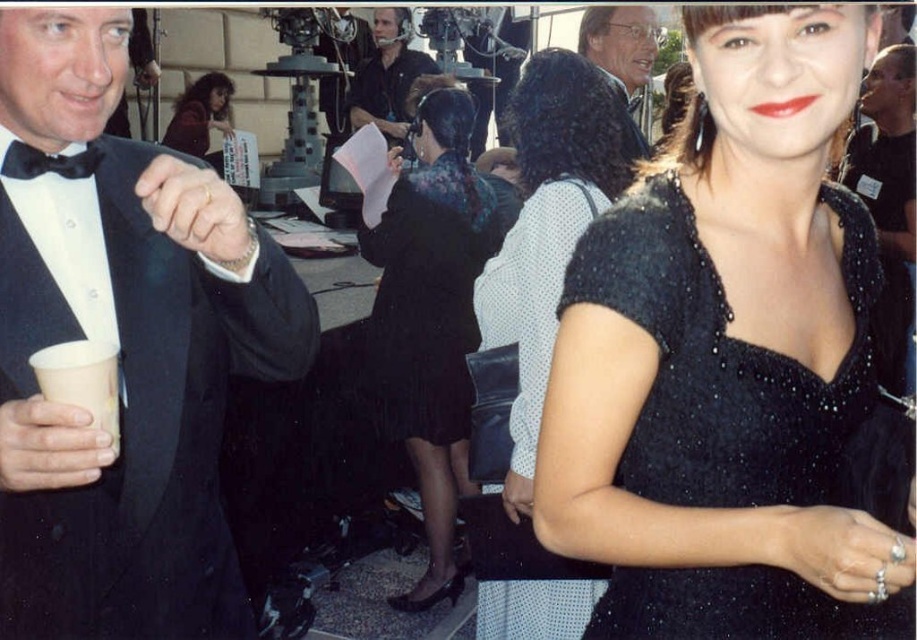
Question: Which object is farther from the camera taking this photo?

Choices:
 (A) matte black dress at center
 (B) white paper cup at left
 (C) black satin bow tie at left
 (D) matte black tuxedo at upper left

Answer: (A)

Question: Can you confirm if sparkly black dress at center is positioned to the right of black sequined dress at center?

Choices:
 (A) no
 (B) yes

Answer: (B)

Question: Is matte black jacket at upper center closer to camera compared to matte black dress at center?

Choices:
 (A) yes
 (B) no

Answer: (A)

Question: In this image, where is velvet black dress at center located relative to matte black headset at center?

Choices:
 (A) below
 (B) above

Answer: (A)

Question: Which object appears farthest from the camera in this image?

Choices:
 (A) white paper cup at left
 (B) sparkly black dress at center
 (C) matte black dress at center
 (D) black satin tuxedo at left

Answer: (C)

Question: Which of these objects is positioned farthest from the matte black dress at center?

Choices:
 (A) matte black headset at center
 (B) matte black jacket at upper center
 (C) sparkly black dress at center
 (D) black satin bow tie at left

Answer: (D)